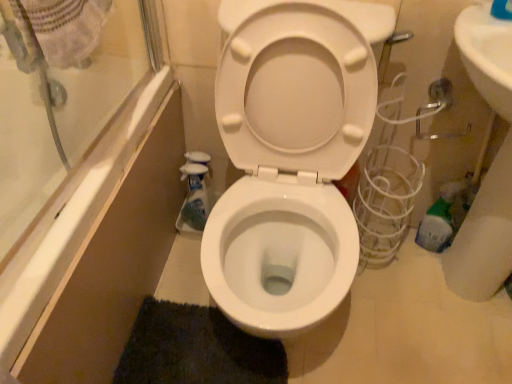
Question: Which direction should I rotate to look at dark green textured bath mat at lower center?

Choices:
 (A) left
 (B) right

Answer: (A)